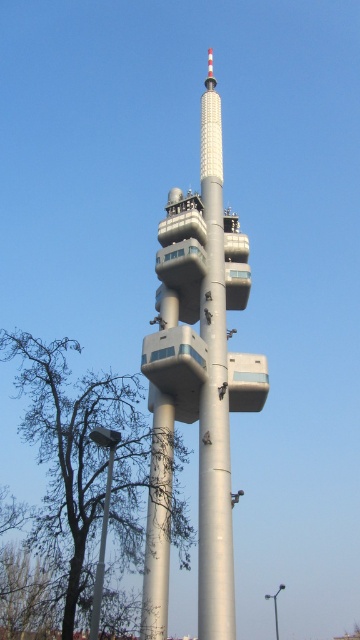
You are an engineer inspecting the telecommunications site. You need to determine if the silver metallic tower at center can fit through a narrow passage that is only wide enough for objects narrower than the brown leafless tree at lower left. Based on the scene, can the tower pass through the passage?

The silver metallic tower at center has a width less than the brown leafless tree at lower left, so it can fit through the passage designed for objects narrower than the tree.

You are standing in front of the telecommunications tower and notice a brown leafless tree at lower left and a metallic gray pole at lower left. Which object is closer to the left edge of the image?

The brown leafless tree at lower left is positioned on the left side of the metallic gray pole at lower left, so it is closer to the left edge of the image.

You are standing in front of the telecommunications tower and want to determine the relative positions of two points marked on the tower. The points are labeled as point (x=191, y=401) and point (x=108, y=467). Which point is closer to you?

Point (x=108, y=467) is closer to you because it is less further to the camera than point (x=191, y=401).